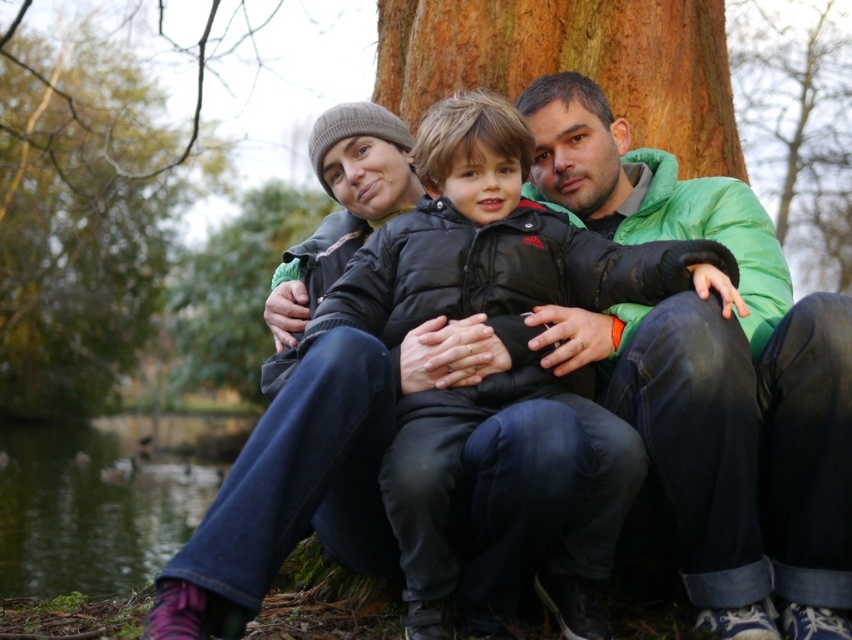
Question: Is brown rough tree trunk at upper center to the left of green matte tree trunk at upper center from the viewer's perspective?

Choices:
 (A) no
 (B) yes

Answer: (B)

Question: Which object is farther from the camera taking this photo?

Choices:
 (A) smooth brown bark at center
 (B) brown rough tree trunk at upper center
 (C) green matte tree trunk at upper center

Answer: (B)

Question: Which point is farther from the camera taking this photo?

Choices:
 (A) (815, 6)
 (B) (117, 259)
 (C) (413, 93)

Answer: (A)

Question: Is black puffer jacket at center closer to camera compared to brown rough tree trunk at upper center?

Choices:
 (A) no
 (B) yes

Answer: (B)

Question: Does brown rough tree trunk at upper center come behind green matte tree trunk at upper center?

Choices:
 (A) yes
 (B) no

Answer: (A)

Question: Estimate the real-world distances between objects in this image. Which object is farther from the green matte jacket at center?

Choices:
 (A) black puffer jacket at center
 (B) green matte tree trunk at upper center

Answer: (B)